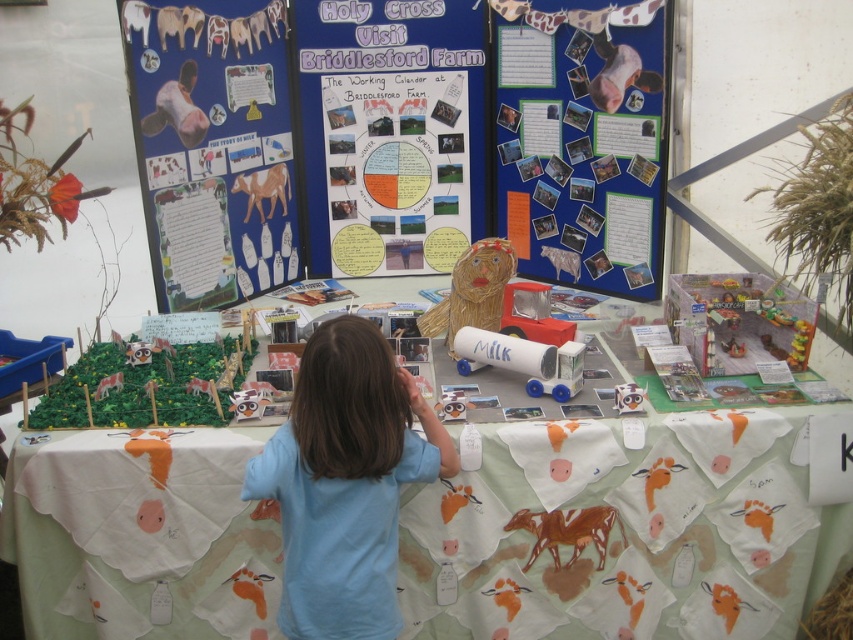
You are standing in front of the display and want to touch both the white paper with cow prints at center and the light brown paper horse at center. Which one can you reach first without moving your position?

The white paper with cow prints at center is closer to the viewer than the light brown paper horse at center, so you can reach it first without moving your position.

You are setting up a display for an event and have a white paper poster at center and a woven straw lion at center. Which object should you place on the table first if you want the larger item to be placed last?

You should place the woven straw lion at center first because the white paper poster at center is bigger, so the larger item should be placed last.

Where is the matte paperboard poster at upper left located in the image?

The matte paperboard poster at upper left is located at point 0.230 in the x coordinate and 0.250 in the y coordinate.